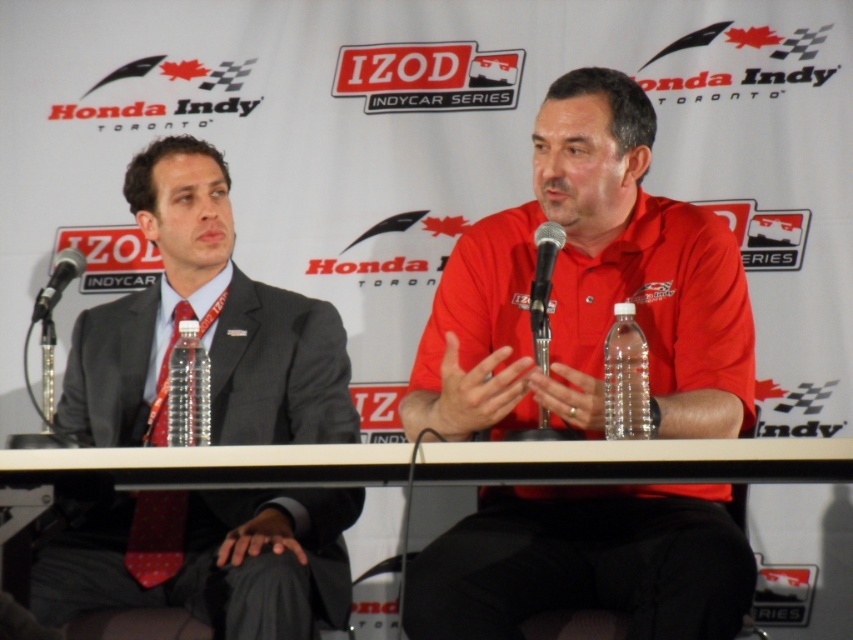
You are organizing a press conference and need to place a name tag on the table. Given that the white plastic table at center is not as tall as the clear plastic bottle at center, will the name tag placed on the table be visible over the bottle?

The white plastic table at center is shorter than the clear plastic bottle at center, so the name tag placed on the table will not be visible over the bottle because the bottle is taller.

Looking at this image, you are attending the Honda Indy Toronto press conference and notice the red dotted tie at left. Can you determine its exact location in the image using coordinates?

The red dotted tie at left is located at coordinates point (155, 536).